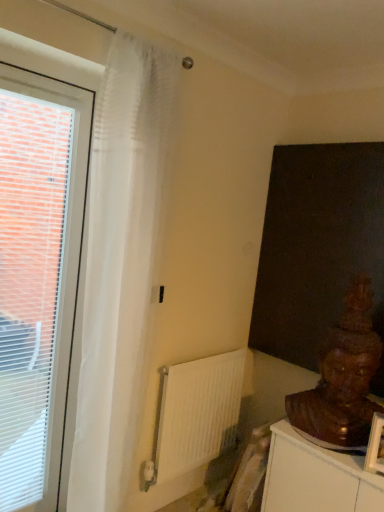
What do you see at coordinates (119, 268) in the screenshot? The width and height of the screenshot is (384, 512). I see `translucent white curtain at left` at bounding box center [119, 268].

This screenshot has width=384, height=512. I want to click on white matte radiator at center, so click(x=196, y=413).

This screenshot has height=512, width=384. I want to click on brown wooden statue at lower right, so click(x=342, y=378).

Considering the relative positions of brown wooden statue at lower right and white plastic window at left in the image provided, is brown wooden statue at lower right to the left of white plastic window at left from the viewer's perspective?

No, brown wooden statue at lower right is not to the left of white plastic window at left.

How many degrees apart are the facing directions of brown wooden statue at lower right and white plastic window at left?

The facing directions of brown wooden statue at lower right and white plastic window at left are 52 degrees apart.

From the picture: Between brown wooden statue at lower right and white plastic window at left, which one has less height?

Standing shorter between the two is brown wooden statue at lower right.

Considering the sizes of objects brown wooden statue at lower right and white plastic window at left in the image provided, who is smaller, brown wooden statue at lower right or white plastic window at left?

Smaller between the two is white plastic window at left.

In the scene shown: Is translucent white curtain at left at the back of brown wooden statue at lower right?

That's not correct — brown wooden statue at lower right is not looking away from translucent white curtain at left.

Does point (360, 420) come farther from viewer compared to point (129, 259)?

Yes.

Visually, is brown wooden statue at lower right positioned to the left or to the right of translucent white curtain at left?

In the image, brown wooden statue at lower right appears on the right side of translucent white curtain at left.

Which object is wider, translucent white curtain at left or white matte radiator at center?

Wider between the two is translucent white curtain at left.

How far apart are translucent white curtain at left and white matte radiator at center?

22.85 inches.

Considering the sizes of objects translucent white curtain at left and white matte radiator at center in the image provided, who is smaller, translucent white curtain at left or white matte radiator at center?

Smaller between the two is white matte radiator at center.

Considering the relative positions of translucent white curtain at left and white matte radiator at center in the image provided, is translucent white curtain at left to the left of white matte radiator at center from the viewer's perspective?

Indeed, translucent white curtain at left is positioned on the left side of white matte radiator at center.

Can you tell me how much translucent white curtain at left and white plastic window at left differ in facing direction?

There is a 3.35-degree angle between the facing directions of translucent white curtain at left and white plastic window at left.

From a real-world perspective, between translucent white curtain at left and white plastic window at left, who is vertically higher?

translucent white curtain at left.

Does translucent white curtain at left have a lesser height compared to white plastic window at left?

In fact, translucent white curtain at left may be taller than white plastic window at left.

Is translucent white curtain at left thinner than brown wooden statue at lower right?

Incorrect, the width of translucent white curtain at left is not less than that of brown wooden statue at lower right.

Considering the sizes of objects translucent white curtain at left and brown wooden statue at lower right in the image provided, who is smaller, translucent white curtain at left or brown wooden statue at lower right?

With smaller size is brown wooden statue at lower right.

From a real-world perspective, is translucent white curtain at left on brown wooden statue at lower right?

Yes, from a real-world perspective, translucent white curtain at left is above brown wooden statue at lower right.

Is translucent white curtain at left oriented away from brown wooden statue at lower right?

translucent white curtain at left does not have its back to brown wooden statue at lower right.

From a real-world perspective, between white matte radiator at center and white plastic window at left, who is vertically higher?

In real-world perspective, white plastic window at left is above.

Identify the location of radiator on the right of the white plastic window at left. (196, 413).

Can you tell me how much white matte radiator at center and white plastic window at left differ in facing direction?

The angular difference between white matte radiator at center and white plastic window at left is 0.988 degrees.

Can you confirm if white matte radiator at center is positioned to the right of white plastic window at left?

Yes, white matte radiator at center is to the right of white plastic window at left.

From the image's perspective, does white matte radiator at center appear higher than brown wooden statue at lower right?

No, from the image's perspective, white matte radiator at center is not over brown wooden statue at lower right.

Can you tell me how much white matte radiator at center and brown wooden statue at lower right differ in facing direction?

They differ by 51 degrees in their facing directions.

From a real-world perspective, who is located higher, white matte radiator at center or brown wooden statue at lower right?

brown wooden statue at lower right.

Considering the relative sizes of white matte radiator at center and brown wooden statue at lower right in the image provided, is white matte radiator at center smaller than brown wooden statue at lower right?

Yes.

You are a GUI agent. You are given a task and a screenshot of the screen. Output one action in this format:
    pyautogui.click(x=<x>, y=<y>)
    Task: Click on the person that appears below the white plastic window at left (from the image's perspective)
    This screenshot has width=384, height=512.
    Given the screenshot: What is the action you would take?
    pyautogui.click(x=342, y=378)

What are the coordinates of `curtain above the brown wooden statue at lower right (from a real-world perspective)` in the screenshot? It's located at (119, 268).

Estimate the real-world distances between objects in this image. Which object is closer to translucent white curtain at left, brown wooden statue at lower right or white plastic window at left?

Among the two, white plastic window at left is located nearer to translucent white curtain at left.

Looking at the image, which one is located closer to translucent white curtain at left, brown wooden statue at lower right or white matte radiator at center?

The object closer to translucent white curtain at left is white matte radiator at center.

Considering their positions, is white plastic window at left positioned closer to brown wooden statue at lower right than translucent white curtain at left?

translucent white curtain at left lies closer to brown wooden statue at lower right than the other object.

Based on their spatial positions, is white plastic window at left or white matte radiator at center closer to brown wooden statue at lower right?

white matte radiator at center is positioned closer to the anchor brown wooden statue at lower right.

Looking at the image, which one is located further to white plastic window at left, white matte radiator at center or translucent white curtain at left?

white matte radiator at center lies further to white plastic window at left than the other object.

Looking at the image, which one is located further to white plastic window at left, brown wooden statue at lower right or white matte radiator at center?

brown wooden statue at lower right lies further to white plastic window at left than the other object.

Based on the photo, from the image, which object appears to be nearer to translucent white curtain at left, white matte radiator at center or white plastic window at left?

white plastic window at left.

From the image, which object appears to be nearer to brown wooden statue at lower right, translucent white curtain at left or white matte radiator at center?

white matte radiator at center lies closer to brown wooden statue at lower right than the other object.

At what (x,y) coordinates should I click in order to perform the action: click on radiator between translucent white curtain at left and brown wooden statue at lower right in the horizontal direction. Please return your answer as a coordinate pair (x, y). Image resolution: width=384 pixels, height=512 pixels. Looking at the image, I should click on (196, 413).

The width and height of the screenshot is (384, 512). In order to click on curtain located between white plastic window at left and white matte radiator at center in the left-right direction in this screenshot , I will do `click(119, 268)`.

You are a GUI agent. You are given a task and a screenshot of the screen. Output one action in this format:
    pyautogui.click(x=<x>, y=<y>)
    Task: Click on the radiator located between white plastic window at left and brown wooden statue at lower right in the left-right direction
    The height and width of the screenshot is (512, 384).
    Given the screenshot: What is the action you would take?
    pyautogui.click(x=196, y=413)

The image size is (384, 512). I want to click on curtain between white plastic window at left and brown wooden statue at lower right from left to right, so click(119, 268).